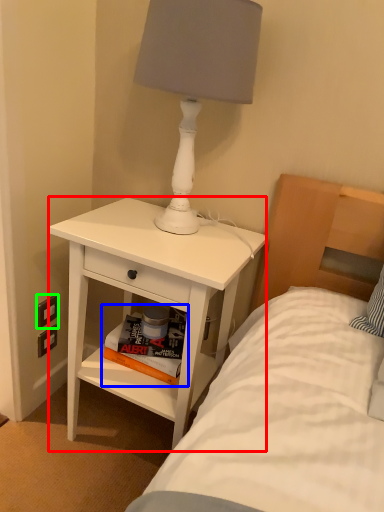
Question: Considering the real-world distances, which object is farthest from nightstand (highlighted by a red box)? magazine (highlighted by a blue box) or electric outlet (highlighted by a green box)?

Choices:
 (A) magazine
 (B) electric outlet

Answer: (B)